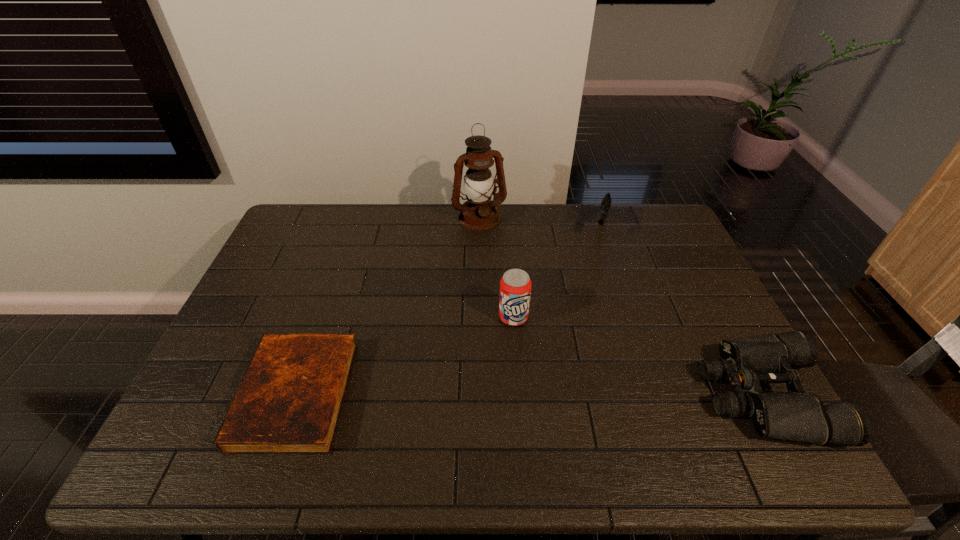
Image resolution: width=960 pixels, height=540 pixels. I want to click on free space on the desktop that is between the leftmost object and the fourth tallest object and is positioned on the surface of the second tallest object, so click(527, 395).

Image resolution: width=960 pixels, height=540 pixels. Find the location of `vacant space on the desktop that is between the leftmost object and the rightmost object and is positioned on the side of the lantern, there is a wick adjustment knob`. vacant space on the desktop that is between the leftmost object and the rightmost object and is positioned on the side of the lantern, there is a wick adjustment knob is located at coordinates (558, 395).

Identify the location of vacant space on the desktop that is between the leftmost object and the binoculars and is positioned at the end of the barrel of the third tallest object. This screenshot has width=960, height=540. (554, 395).